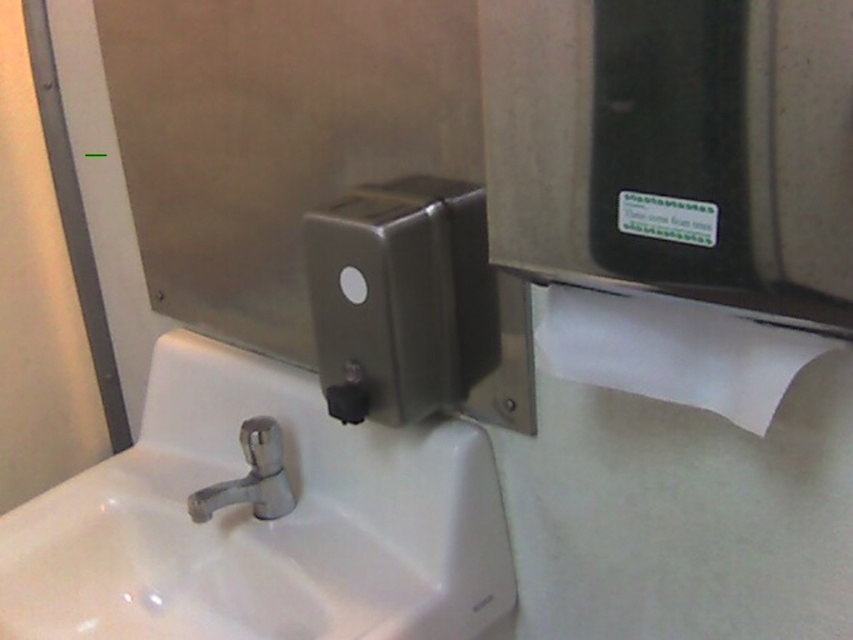
Question: Which object appears closest to the camera in this image?

Choices:
 (A) stainless steel hand dryer at upper right
 (B) white glossy sink at lower left

Answer: (A)

Question: Does white glossy sink at lower left have a greater width compared to chrome metallic faucet at center?

Choices:
 (A) no
 (B) yes

Answer: (B)

Question: Does stainless steel hand dryer at upper right have a lesser width compared to chrome metallic faucet at center?

Choices:
 (A) yes
 (B) no

Answer: (B)

Question: Based on their relative distances, which object is nearer to the stainless steel hand dryer at upper right?

Choices:
 (A) chrome metallic faucet at center
 (B) white glossy sink at lower left
 (C) satin nickel dispenser at center
 (D) white paper at right

Answer: (D)

Question: Can you confirm if stainless steel hand dryer at upper right is positioned above chrome metallic faucet at center?

Choices:
 (A) no
 (B) yes

Answer: (B)

Question: Which point appears farthest from the camera in this image?

Choices:
 (A) (604, 26)
 (B) (560, 339)

Answer: (B)